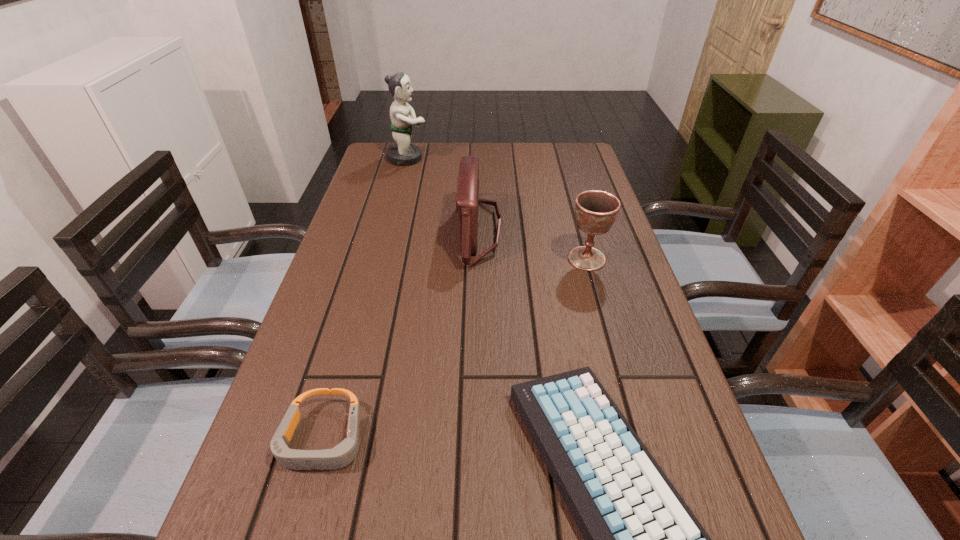
Identify the location of vacant area between the goggles and the chalice. (455, 349).

Find the location of a particular element. Image resolution: width=960 pixels, height=540 pixels. blank region between the goggles and the chalice is located at coordinates (455, 349).

Image resolution: width=960 pixels, height=540 pixels. Identify the location of vacant space in between the shoulder bag and the chalice. (534, 245).

This screenshot has width=960, height=540. Identify the location of free space between the shoulder bag and the chalice. (534, 245).

The width and height of the screenshot is (960, 540). I want to click on vacant space that's between the shoulder bag and the farthest object, so click(x=444, y=194).

The height and width of the screenshot is (540, 960). I want to click on unoccupied position between the shoulder bag and the chalice, so click(534, 245).

You are a GUI agent. You are given a task and a screenshot of the screen. Output one action in this format:
    pyautogui.click(x=<x>, y=<y>)
    Task: Click on the free spot between the goggles and the chalice
    
    Given the screenshot: What is the action you would take?
    pyautogui.click(x=455, y=349)

Image resolution: width=960 pixels, height=540 pixels. In order to click on the fourth closest object to the shoulder bag in this screenshot , I will do `click(344, 453)`.

Find the location of a particular element. The width and height of the screenshot is (960, 540). object that is the nearest to the shoulder bag is located at coordinates (596, 211).

Identify the location of blank area in the image that satisfies the following two spatial constraints: 1. on the front-facing side of the farthest object; 2. on the left side of the chalice. (381, 259).